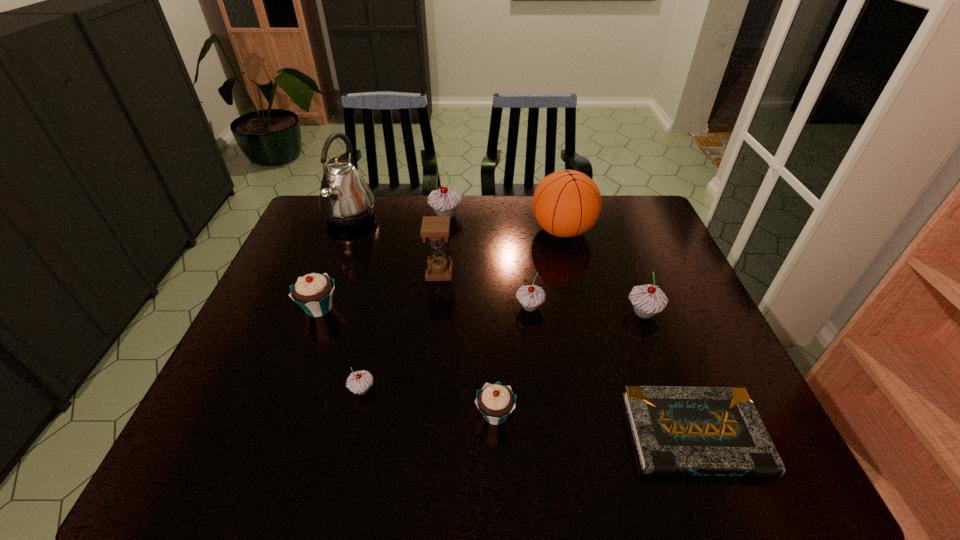
In order to click on vacant space at the far left corner of the desktop in this screenshot , I will do `click(325, 234)`.

What are the coordinates of `free region at the far right corner of the desktop` in the screenshot? It's located at (630, 222).

This screenshot has height=540, width=960. What are the coordinates of `vacant region between the second gray cupcake from right to left and the rightmost gray cupcake` in the screenshot? It's located at (587, 309).

Identify the location of vacant space that is in between the eighth object from right to left and the biggest gray cupcake. (404, 302).

Where is `free space between the sixth object from left to right and the leftmost cupcake`? The height and width of the screenshot is (540, 960). free space between the sixth object from left to right and the leftmost cupcake is located at coordinates (407, 361).

At what (x,y) coordinates should I click in order to perform the action: click on free point between the basketball and the second tallest cupcake. Please return your answer as a coordinate pair (x, y). Image resolution: width=960 pixels, height=540 pixels. Looking at the image, I should click on (603, 272).

Find the location of a particular element. The height and width of the screenshot is (540, 960). free area in between the third gray cupcake from right to left and the third cupcake from right to left is located at coordinates (470, 315).

I want to click on vacant space that's between the seventh nearest object and the basketball, so click(501, 252).

This screenshot has height=540, width=960. In order to click on vacant region between the basketball and the tallest object in this screenshot , I will do `click(456, 223)`.

Locate an element on the screen. free space between the tallest object and the farthest gray cupcake is located at coordinates (397, 215).